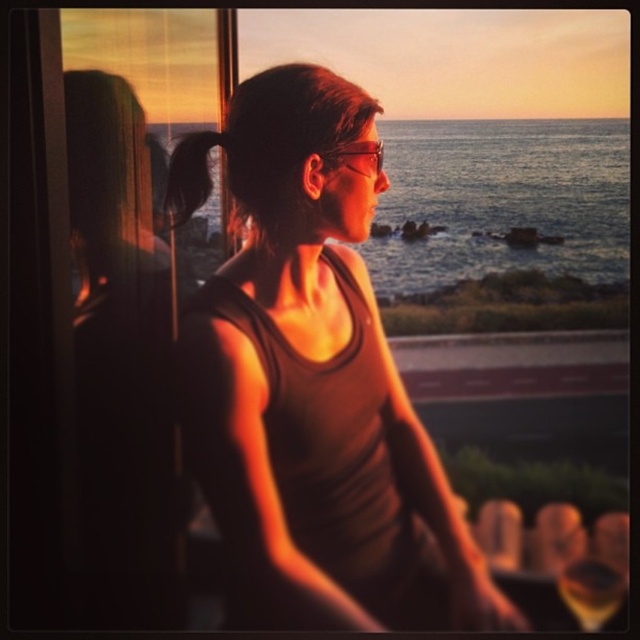
Question: Can you confirm if matte brown tank top at center is positioned to the left of matte black hair at left?

Choices:
 (A) yes
 (B) no

Answer: (B)

Question: Can you confirm if matte brown tank top at center is bigger than black hair at upper left?

Choices:
 (A) no
 (B) yes

Answer: (B)

Question: Estimate the real-world distances between objects in this image. Which object is farther from the translucent glass wine at lower right?

Choices:
 (A) black hair at upper left
 (B) matte black goggles at center

Answer: (A)

Question: Does black hair at upper left appear over translucent glass wine at lower right?

Choices:
 (A) no
 (B) yes

Answer: (B)

Question: Which point is closer to the camera taking this photo?

Choices:
 (A) (339, 154)
 (B) (392, 545)
 (C) (138, 275)

Answer: (B)

Question: Among these objects, which one is nearest to the camera?

Choices:
 (A) matte brown tank top at center
 (B) black hair at upper left
 (C) translucent glass wine at lower right
 (D) matte black goggles at center

Answer: (C)